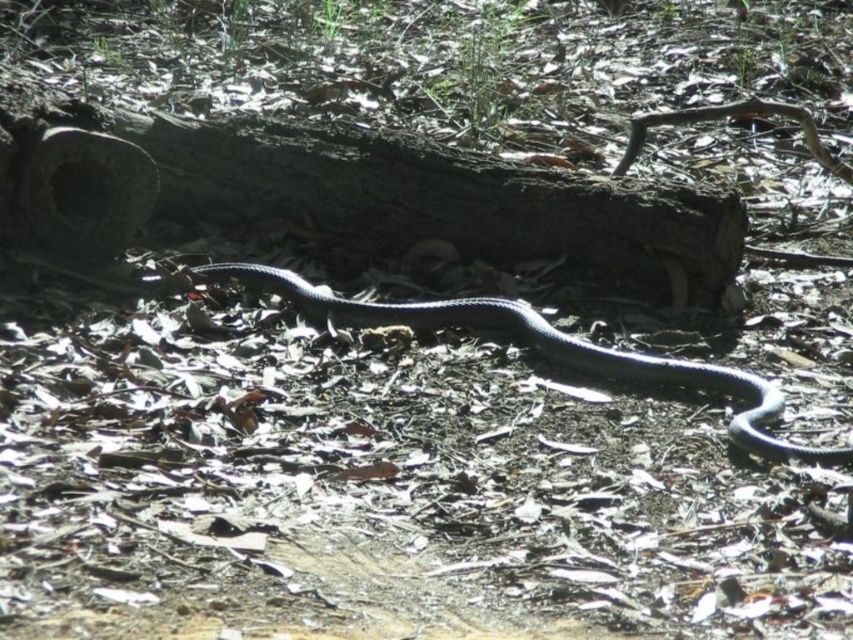
Question: Which point appears closest to the camera in this image?

Choices:
 (A) (669, 291)
 (B) (611, 365)

Answer: (B)

Question: Is dark brown rough log at center bigger than shiny black snake at center?

Choices:
 (A) no
 (B) yes

Answer: (B)

Question: Is dark brown rough log at center positioned in front of shiny black snake at center?

Choices:
 (A) yes
 (B) no

Answer: (B)

Question: Can you confirm if dark brown rough log at center is positioned above shiny black snake at center?

Choices:
 (A) yes
 (B) no

Answer: (A)